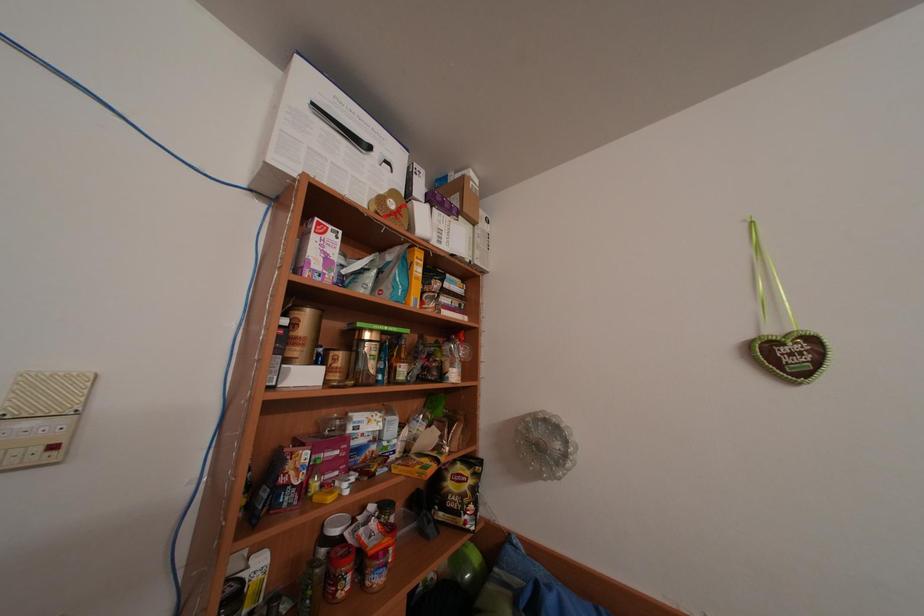
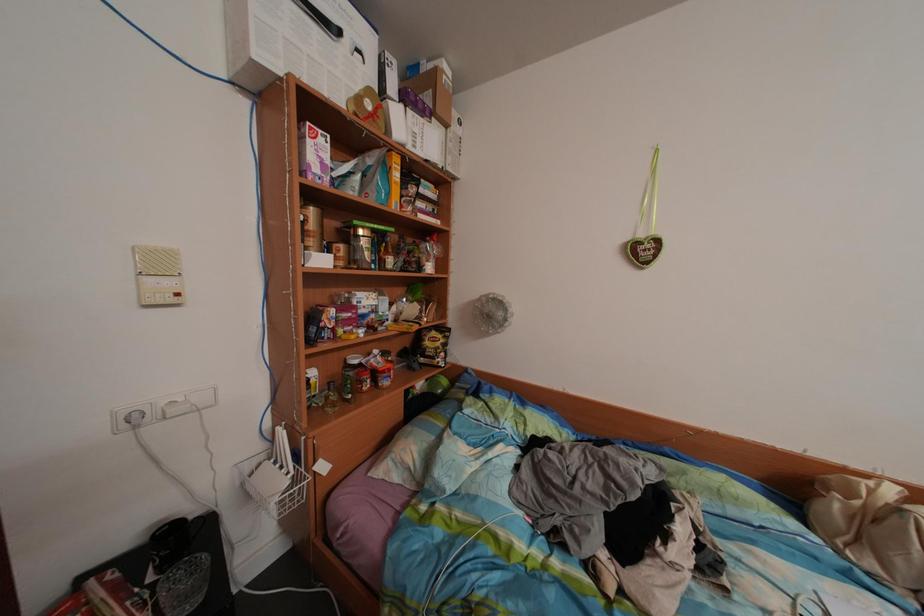
Question: The images are taken continuously from a first-person perspective. In which direction is your viewpoint rotating?

Choices:
 (A) Left
 (B) Right
 (C) Up
 (D) Down

Answer: (D)